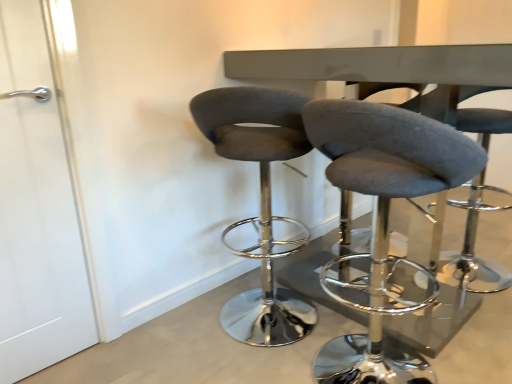
Question: Is velvet grey stool at center, which is the 3th chair from left to right, inside the boundaries of metallic gray table at center, or outside?

Choices:
 (A) inside
 (B) outside

Answer: (B)

Question: From the image's perspective, is velvet grey stool at center, which is the 3th chair from left to right, positioned above or below metallic gray table at center?

Choices:
 (A) below
 (B) above

Answer: (A)

Question: Which object is the farthest from the velvet grey stool at center, which is the 1th chair in right-to-left order?

Choices:
 (A) gray fabric stool at center, the second chair when ordered from left to right
 (B) velvet grey stool at center, positioned as the third chair in right-to-left order
 (C) white matte door at left
 (D) metallic gray table at center

Answer: (C)

Question: Estimate the real-world distances between objects in this image. Which object is farther from the gray fabric stool at center, positioned as the 2th chair in right-to-left order?

Choices:
 (A) velvet grey stool at center, positioned as the third chair in right-to-left order
 (B) velvet grey stool at center, which is the 1th chair in right-to-left order
 (C) white matte door at left
 (D) metallic gray table at center

Answer: (C)